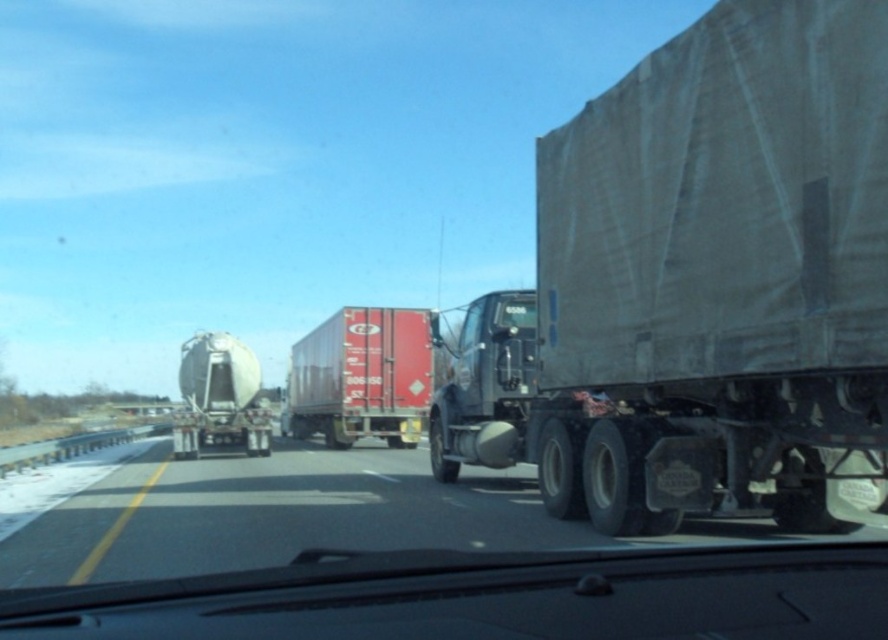
Question: Does gray tarpaulin trailer at right come in front of red matte container at center?

Choices:
 (A) no
 (B) yes

Answer: (B)

Question: Which is farther from the red matte container at center?

Choices:
 (A) semi-gloss white tanker at center
 (B) gray tarpaulin trailer at right

Answer: (B)

Question: Does red matte container at center appear on the left side of semi-gloss white tanker at center?

Choices:
 (A) no
 (B) yes

Answer: (B)

Question: Is red matte container at center smaller than semi-gloss white tanker at center?

Choices:
 (A) no
 (B) yes

Answer: (A)

Question: Which point is closer to the camera?

Choices:
 (A) (324, 392)
 (B) (256, 408)

Answer: (B)

Question: Which of these objects is positioned farthest from the red matte container at center?

Choices:
 (A) gray tarpaulin trailer at right
 (B) semi-gloss white tanker at center

Answer: (A)